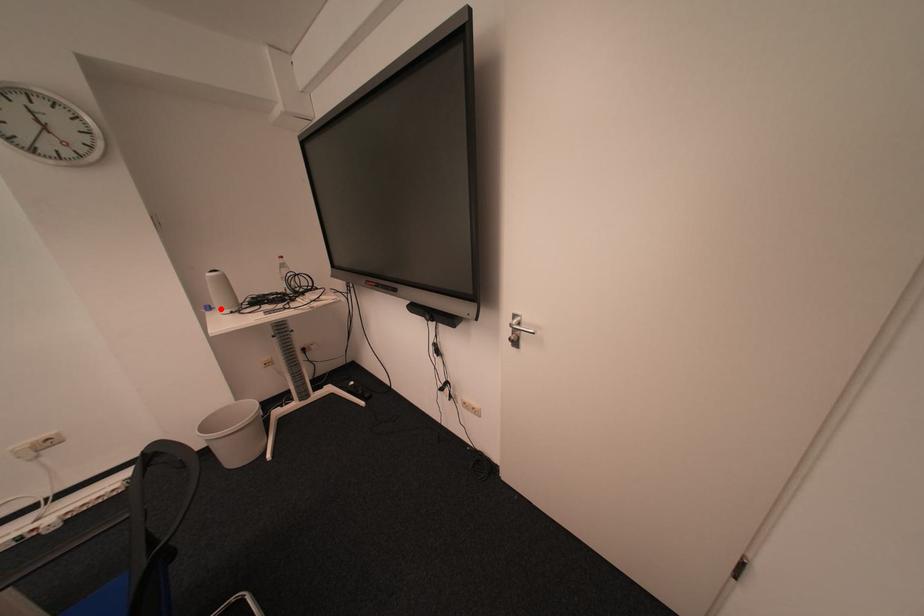
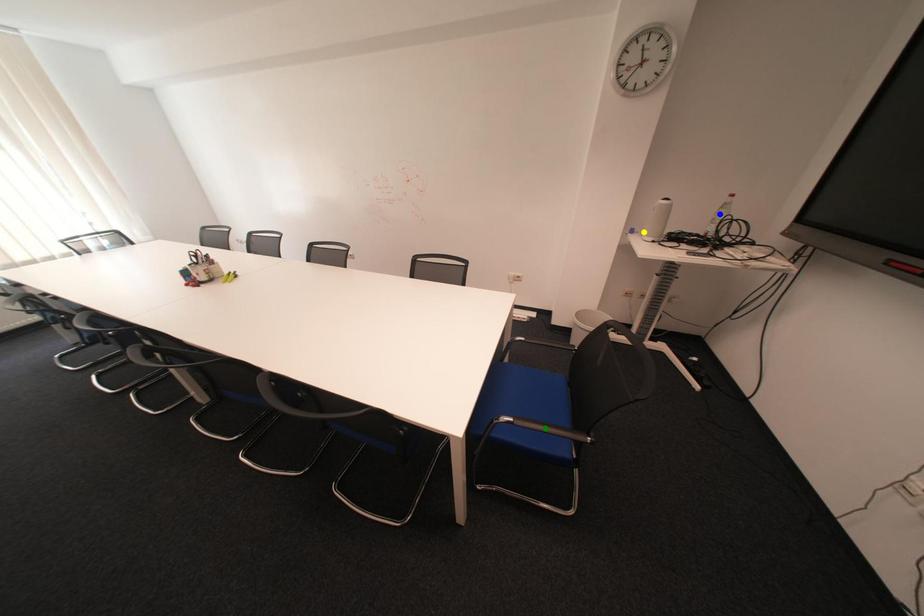
Question: I am providing you with two images of the same scene from different viewpoints. A red point is marked on the first image. You are given multiple points on the second image. Which point in image 2 is actually the same real-world point as the red point in image 1?

Choices:
 (A) yellow point
 (B) blue point
 (C) green point

Answer: (A)